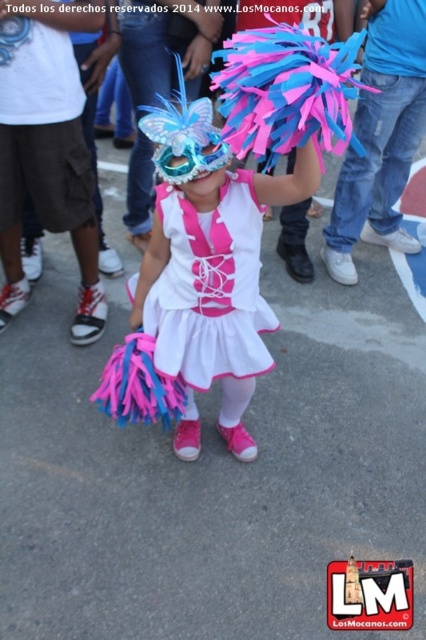
Question: Among these objects, which one is farthest from the camera?

Choices:
 (A) pink satin ballet skirt at center
 (B) white satin dress at center

Answer: (A)

Question: Does matte plastic mask at center appear over pink satin ballet skirt at center?

Choices:
 (A) no
 (B) yes

Answer: (A)

Question: Is matte plastic mask at center to the right of white satin dress at center from the viewer's perspective?

Choices:
 (A) no
 (B) yes

Answer: (A)

Question: Can you confirm if matte plastic mask at center is positioned below white satin dress at center?

Choices:
 (A) yes
 (B) no

Answer: (A)

Question: Which point is closer to the camera taking this photo?

Choices:
 (A) (158, 337)
 (B) (190, 352)
 (C) (97, 13)

Answer: (A)

Question: Which object appears closest to the camera in this image?

Choices:
 (A) matte plastic mask at center
 (B) pink satin ballet skirt at center
 (C) white satin dress at center

Answer: (A)